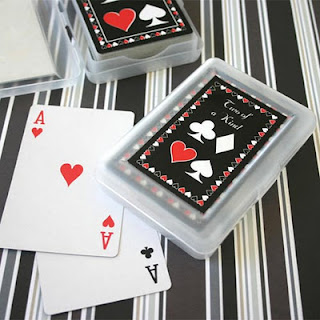
Where is `table top`? Image resolution: width=320 pixels, height=320 pixels. table top is located at coordinates (285, 61).